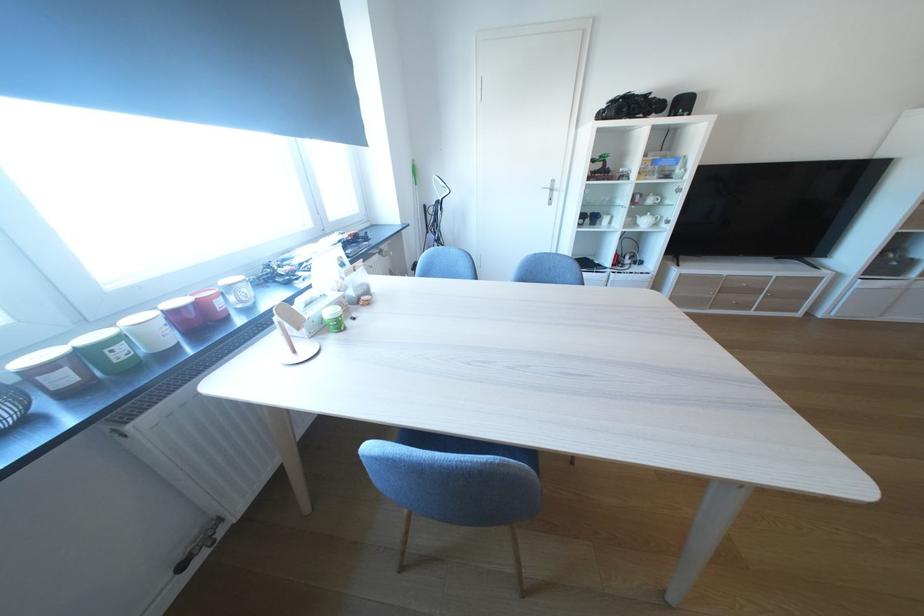
Find where to turn the white radiator valve. Please return your answer as a coordinate pair (x, y).

(199, 545)